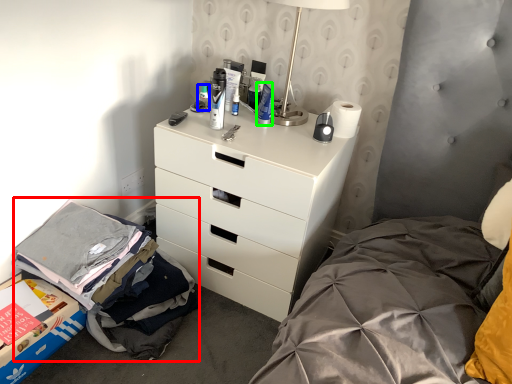
Question: Which object is the farthest from clothing (highlighted by a red box)? Choose among these: toiletry (highlighted by a blue box) or toiletry (highlighted by a green box).

Choices:
 (A) toiletry
 (B) toiletry

Answer: (B)